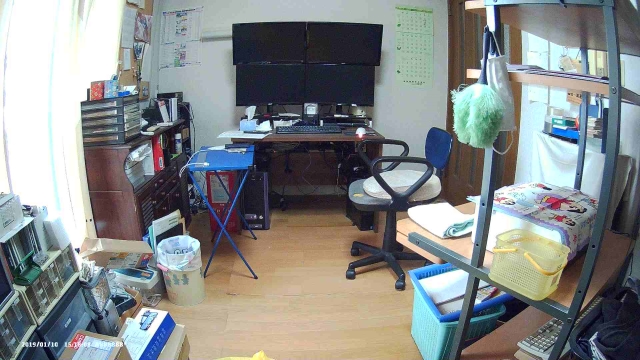
Locate an element on the screen. trash can is located at coordinates (182, 245).